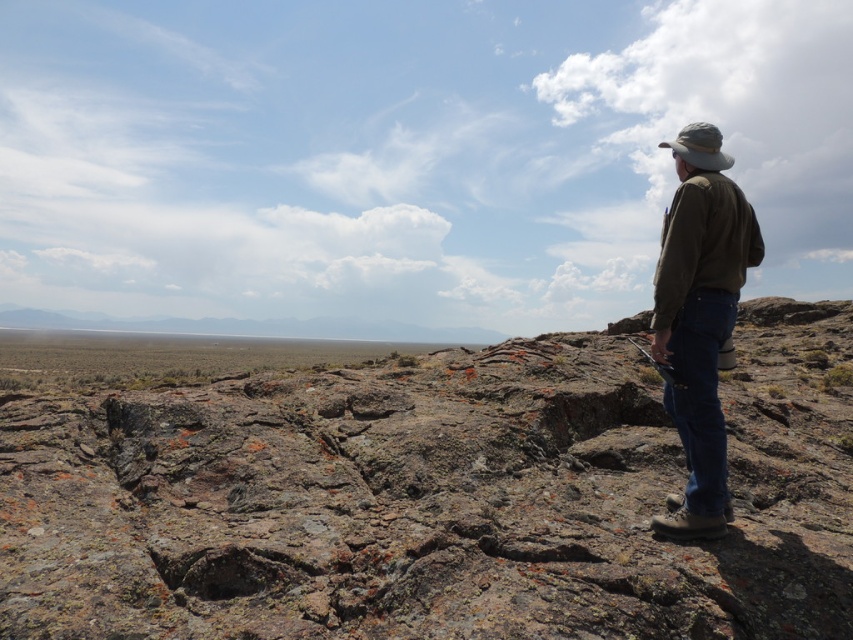
Is rusty rock at center above khaki fabric hat at upper right?

No.

Is point (635, 577) in front of point (715, 132)?

That is True.

In order to click on rusty rock at center in this screenshot , I will do `click(416, 486)`.

Is olive-green fabric jacket at center-right above khaki fabric hat at upper right?

Incorrect, olive-green fabric jacket at center-right is not positioned above khaki fabric hat at upper right.

The height and width of the screenshot is (640, 853). What do you see at coordinates (699, 317) in the screenshot? I see `olive-green fabric jacket at center-right` at bounding box center [699, 317].

Image resolution: width=853 pixels, height=640 pixels. Identify the location of olive-green fabric jacket at center-right. tap(699, 317).

Which is above, rusty rock at center or olive-green fabric jacket at center-right?

olive-green fabric jacket at center-right is higher up.

How distant is rusty rock at center from olive-green fabric jacket at center-right?

rusty rock at center is 42.45 meters from olive-green fabric jacket at center-right.

Between point (837, 593) and point (712, 164), which one is positioned in front?

Positioned in front is point (837, 593).

Find the location of a particular element. rusty rock at center is located at coordinates (416, 486).